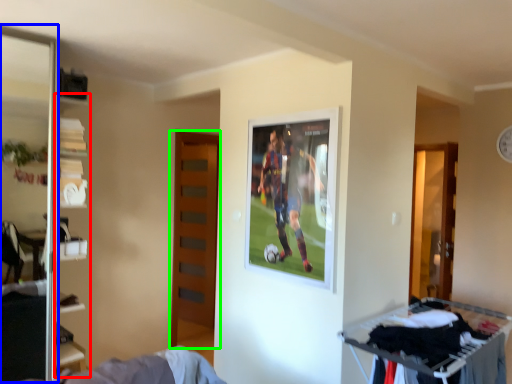
Question: Which object is the farthest from bookshelf (highlighted by a red box)? Choose among these: screen door (highlighted by a blue box) or door (highlighted by a green box).

Choices:
 (A) screen door
 (B) door

Answer: (B)